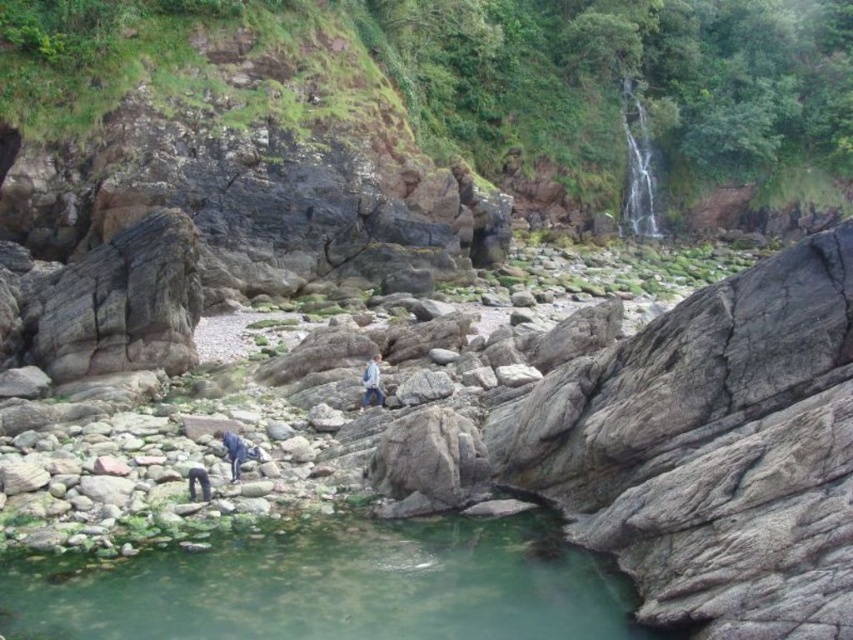
Does point (227, 451) lie in front of point (190, 477)?

That is False.

How distant is blue denim pants at lower left from dark blue fabric person at lower left?

They are 3.86 feet apart.

Who is more distant from viewer, (244, 444) or (192, 490)?

The point (244, 444) is more distant.

Find the location of a particular element. The height and width of the screenshot is (640, 853). blue denim pants at lower left is located at coordinates (231, 451).

Is point (370, 387) in front of point (198, 477)?

No.

Is point (372, 360) farther from camera compared to point (199, 483)?

Yes.

You are a GUI agent. You are given a task and a screenshot of the screen. Output one action in this format:
    pyautogui.click(x=<x>, y=<y>)
    Task: Click on the light blue denim jacket at center
    The image size is (853, 640).
    Given the screenshot: What is the action you would take?
    pyautogui.click(x=370, y=384)

I want to click on light blue denim jacket at center, so click(x=370, y=384).

Does green translucent water at lower center appear on the left side of blue denim pants at lower left?

In fact, green translucent water at lower center is to the right of blue denim pants at lower left.

Is point (149, 556) positioned behind point (241, 448)?

No, (149, 556) is closer to viewer.

Where is `green translucent water at lower center`? The height and width of the screenshot is (640, 853). green translucent water at lower center is located at coordinates (332, 586).